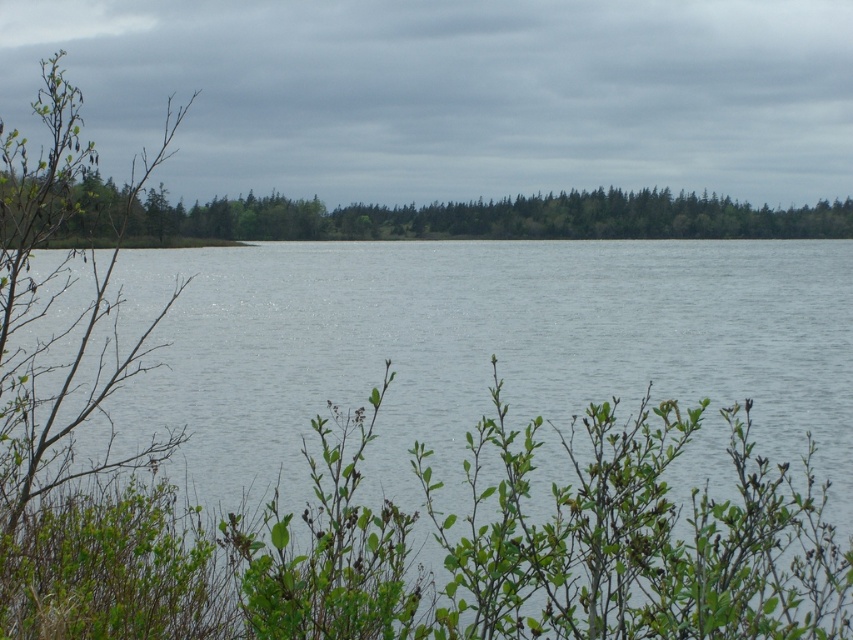
Between green leafy trees at center and green grass at center, which one has less height?

Standing shorter between the two is green grass at center.

Does point (370, 208) come in front of point (103, 244)?

No.

Identify the location of green leafy trees at center. The height and width of the screenshot is (640, 853). (492, 218).

The image size is (853, 640). I want to click on green leafy trees at center, so click(492, 218).

The image size is (853, 640). Identify the location of clear water at center. (473, 448).

Which is more to the left, clear water at center or green leafy trees at center?

Positioned to the left is green leafy trees at center.

Does point (190, 460) come in front of point (485, 214)?

Yes, it is.

Identify the location of clear water at center. (473, 448).

Who is more forward, (308, 392) or (108, 236)?

Point (308, 392)

Does clear water at center have a smaller size compared to green grass at center?

Incorrect, clear water at center is not smaller in size than green grass at center.

You are a GUI agent. You are given a task and a screenshot of the screen. Output one action in this format:
    pyautogui.click(x=<x>, y=<y>)
    Task: Click on the clear water at center
    The width and height of the screenshot is (853, 640).
    Given the screenshot: What is the action you would take?
    pyautogui.click(x=473, y=448)